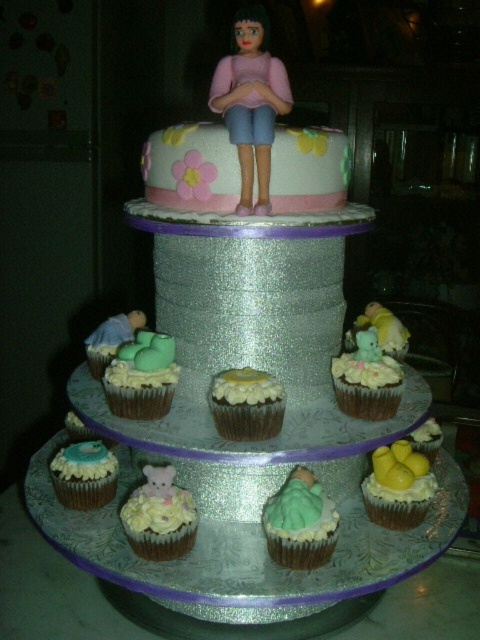
Can you confirm if blue frosted cupcake at lower left is bigger than yellow frosting cupcake at lower right?

Incorrect, blue frosted cupcake at lower left is not larger than yellow frosting cupcake at lower right.

Is blue frosted cupcake at lower left below yellow frosting cupcake at lower right?

Indeed, blue frosted cupcake at lower left is positioned under yellow frosting cupcake at lower right.

Is point (62, 499) positioned in front of point (430, 458)?

Yes.

This screenshot has width=480, height=640. In order to click on blue frosted cupcake at lower left in this screenshot , I will do `click(84, 476)`.

Who is more forward, (158, 518) or (425, 420)?

Point (158, 518)

Can you confirm if light yellow frosting at center is positioned to the right of yellow frosting cupcake at lower right?

In fact, light yellow frosting at center is to the left of yellow frosting cupcake at lower right.

What do you see at coordinates (159, 516) in the screenshot? This screenshot has height=640, width=480. I see `light yellow frosting at center` at bounding box center [159, 516].

I want to click on light yellow frosting at center, so click(x=159, y=516).

Is white frosting cupcake at center further to the viewer compared to blue frosted cupcake at lower left?

That is False.

Can you confirm if white frosting cupcake at center is taller than blue frosted cupcake at lower left?

Incorrect, white frosting cupcake at center's height is not larger of blue frosted cupcake at lower left's.

Describe the element at coordinates (247, 404) in the screenshot. This screenshot has height=640, width=480. I see `white frosting cupcake at center` at that location.

Find the location of `white frosting cupcake at center`. white frosting cupcake at center is located at coordinates (247, 404).